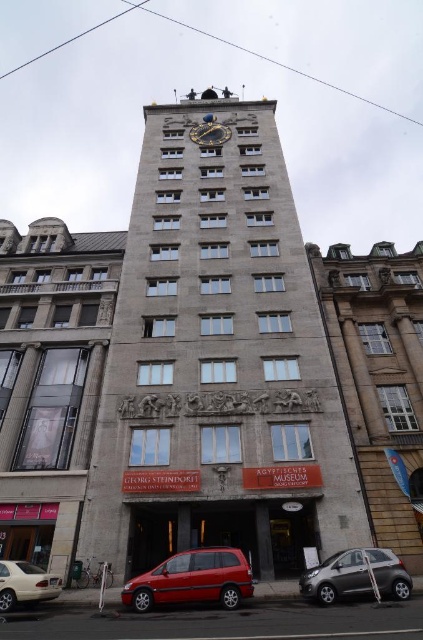
Question: Based on their relative distances, which object is farther from the matte silver sedan at lower left?

Choices:
 (A) brown stone building at right
 (B) gray stone clock tower at center
 (C) metallic gray hatchback at lower right
 (D) goldmetallicclock at upper center

Answer: (D)

Question: Does gray stone clock tower at center have a larger size compared to metallic gray hatchback at lower right?

Choices:
 (A) no
 (B) yes

Answer: (B)

Question: Which point is farther to the camera?

Choices:
 (A) (354, 292)
 (B) (82, 444)

Answer: (A)

Question: Observing the image, what is the correct spatial positioning of brown stone building at right in reference to goldmetallicclock at upper center?

Choices:
 (A) below
 (B) above

Answer: (A)

Question: Does brown stone building at right appear under metallic gray hatchback at lower right?

Choices:
 (A) yes
 (B) no

Answer: (B)

Question: Which of the following is the closest to the observer?

Choices:
 (A) (32, 352)
 (B) (5, 577)

Answer: (B)